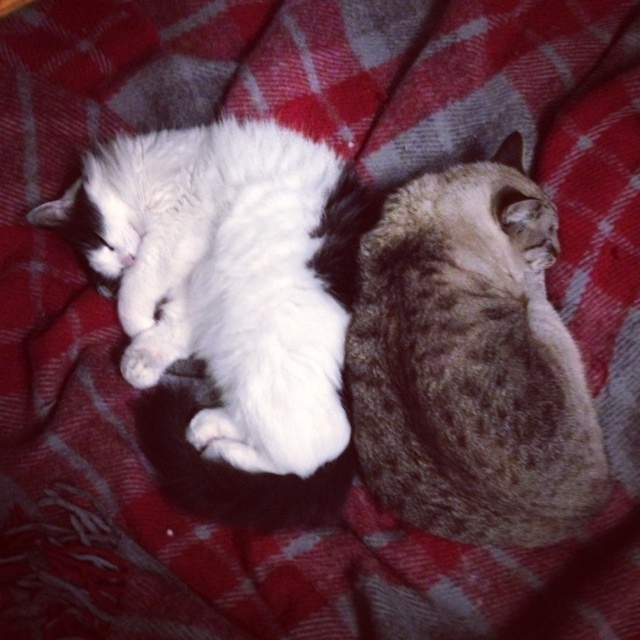
Does gray textured cat at center appear over white fluffy cat at upper left?

No.

Which is in front, point (420, 241) or point (156, 288)?

Point (420, 241)

Locate an element on the screen. Image resolution: width=640 pixels, height=640 pixels. gray textured cat at center is located at coordinates (470, 362).